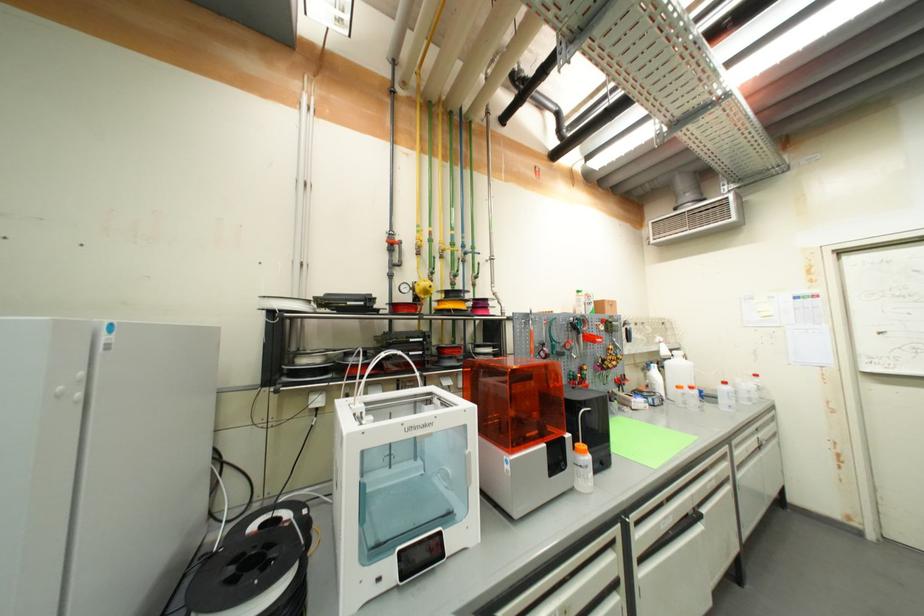
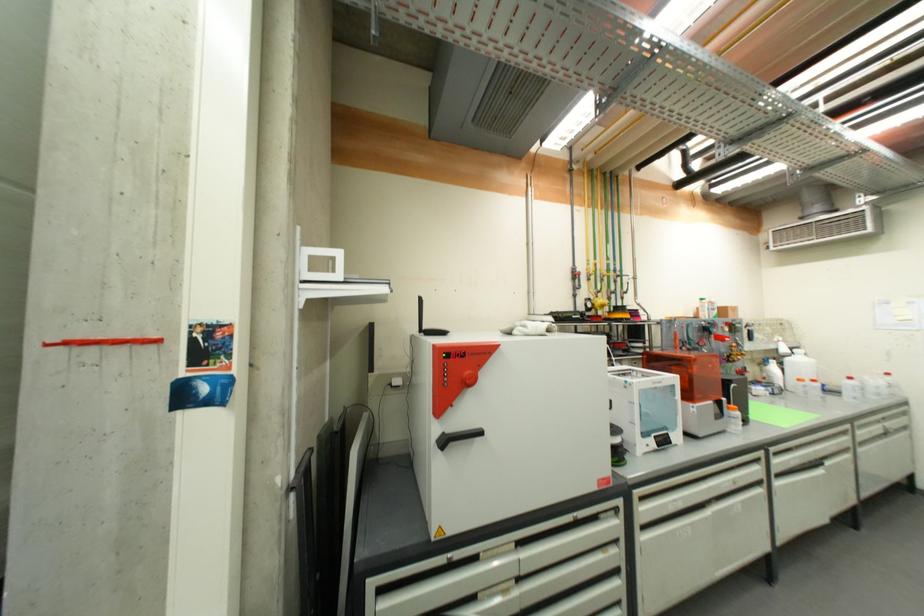
What movement of the cameraman would produce the second image?

The movement direction of the cameraman is left, backward.